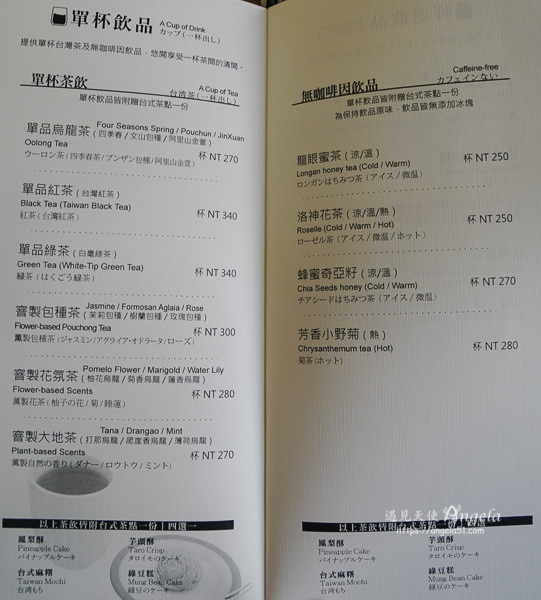
This screenshot has height=600, width=541. I want to click on picture, so click(x=79, y=493).